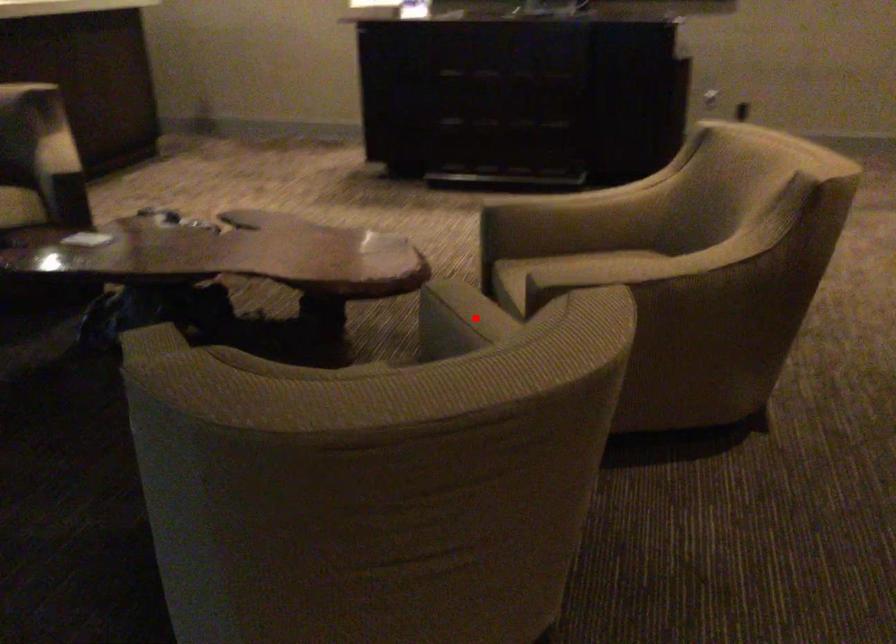
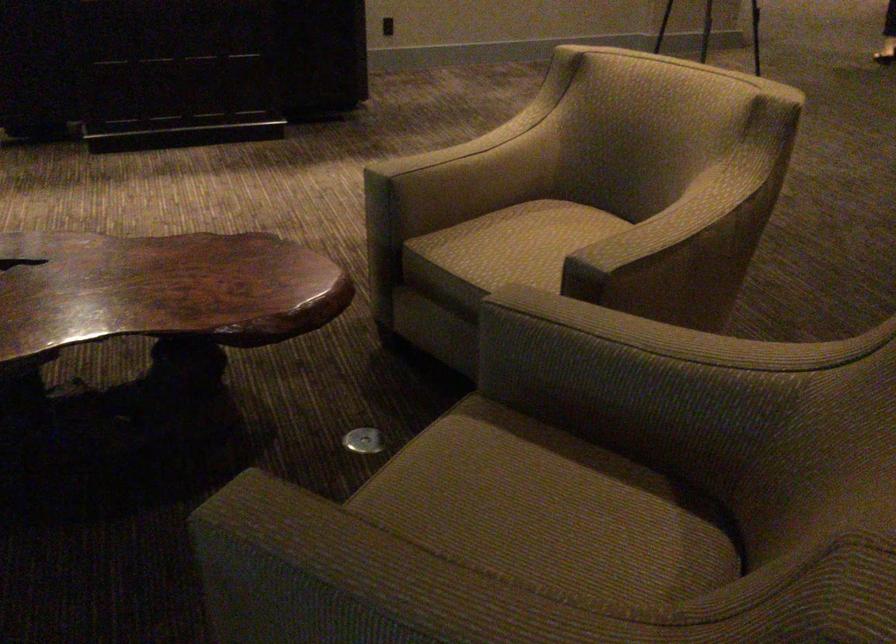
Locate, in the second image, the point that corresponds to the highlighted location in the first image.

(631, 330)